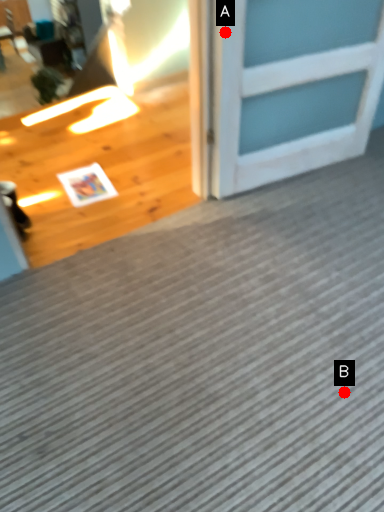
Question: Two points are circled on the image, labeled by A and B beside each circle. Which of the following is the closest to the observer?

Choices:
 (A) A is closer
 (B) B is closer

Answer: (B)